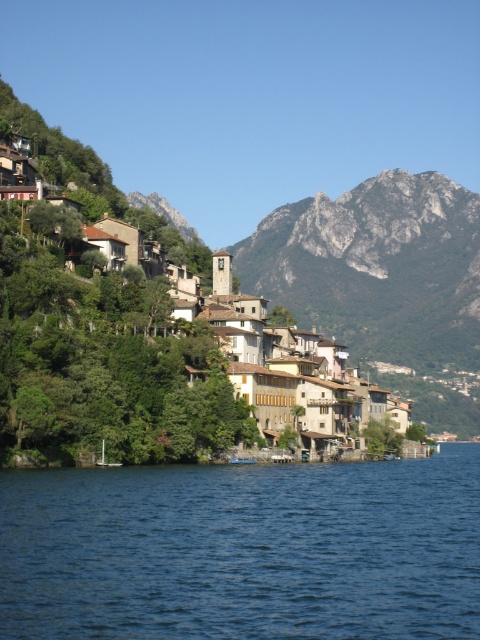
Is blue liquid water at lower center smaller than rugged stone mountain at upper center?

Yes, blue liquid water at lower center is smaller than rugged stone mountain at upper center.

Which is in front, point (446, 531) or point (448, 342)?

Positioned in front is point (446, 531).

I want to click on blue liquid water at lower center, so click(243, 550).

Is brown wooden houses at center shorter than rugged stone mountain at upper center?

Indeed, brown wooden houses at center has a lesser height compared to rugged stone mountain at upper center.

How far apart are brown wooden houses at center and rugged stone mountain at upper center?

1221.19 feet

Between point (158, 385) and point (479, 300), which one is positioned in front?

Point (158, 385) is more forward.

You are a GUI agent. You are given a task and a screenshot of the screen. Output one action in this format:
    pyautogui.click(x=<x>, y=<y>)
    Task: Click on the brown wooden houses at center
    Image resolution: width=480 pixels, height=640 pixels.
    Given the screenshot: What is the action you would take?
    pyautogui.click(x=100, y=353)

How far apart are blue liquid water at lower center and brown wooden houses at center?

blue liquid water at lower center is 12.71 meters away from brown wooden houses at center.

Which is below, blue liquid water at lower center or brown wooden houses at center?

blue liquid water at lower center is below.

You are a GUI agent. You are given a task and a screenshot of the screen. Output one action in this format:
    pyautogui.click(x=<x>, y=<y>)
    Task: Click on the blue liquid water at lower center
    This screenshot has width=480, height=640.
    Given the screenshot: What is the action you would take?
    pyautogui.click(x=243, y=550)

Where is `blue liquid water at lower center`? The height and width of the screenshot is (640, 480). blue liquid water at lower center is located at coordinates (243, 550).